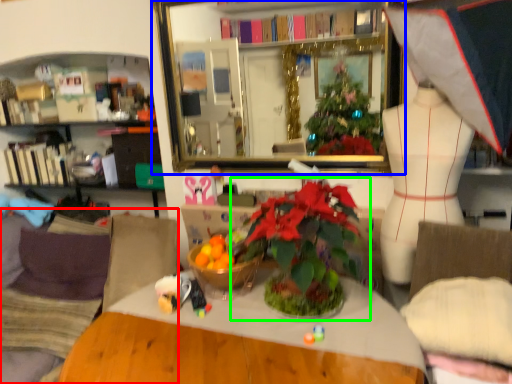
Question: Which object is the farthest from couch (highlighted by a red box)? Choose among these: mirror (highlighted by a blue box) or houseplant (highlighted by a green box).

Choices:
 (A) mirror
 (B) houseplant

Answer: (A)